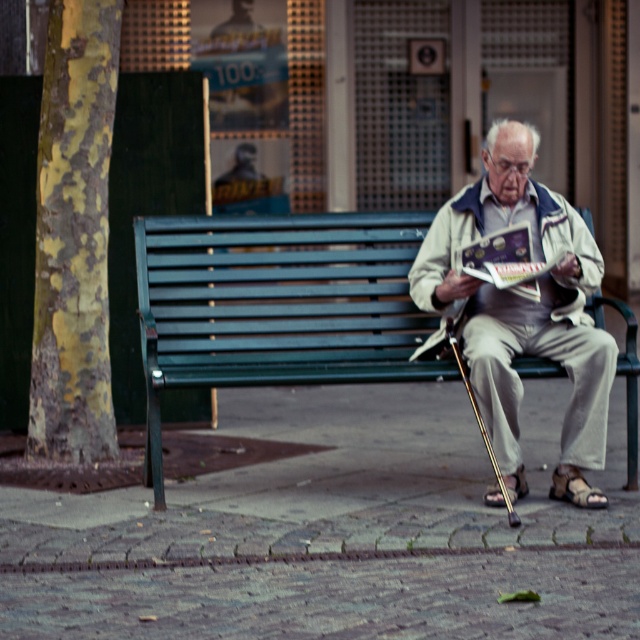
Is beige fabric jacket at center to the left of matte paper book at center from the viewer's perspective?

In fact, beige fabric jacket at center is to the right of matte paper book at center.

The image size is (640, 640). I want to click on beige fabric jacket at center, so click(x=524, y=310).

Is point (580, 221) more distant than point (476, 243)?

Yes, point (580, 221) is farther from viewer.

This screenshot has width=640, height=640. Identify the location of beige fabric jacket at center. (524, 310).

Does green painted wood bench at center come behind matte paper book at center?

No, it is in front of matte paper book at center.

Can you confirm if green painted wood bench at center is positioned below matte paper book at center?

Yes.

Does point (177, 352) lie in front of point (531, 268)?

No, (177, 352) is further to viewer.

At what (x,y) coordinates should I click in order to perform the action: click on green painted wood bench at center. Please return your answer as a coordinate pair (x, y). Image resolution: width=640 pixels, height=640 pixels. Looking at the image, I should click on (276, 305).

Does point (381, 374) come in front of point (602, 332)?

Yes, point (381, 374) is in front of point (602, 332).

Can you confirm if green painted wood bench at center is positioned below beige fabric jacket at center?

No, green painted wood bench at center is not below beige fabric jacket at center.

Which is behind, point (140, 250) or point (481, 397)?

Positioned behind is point (140, 250).

I want to click on green painted wood bench at center, so click(276, 305).